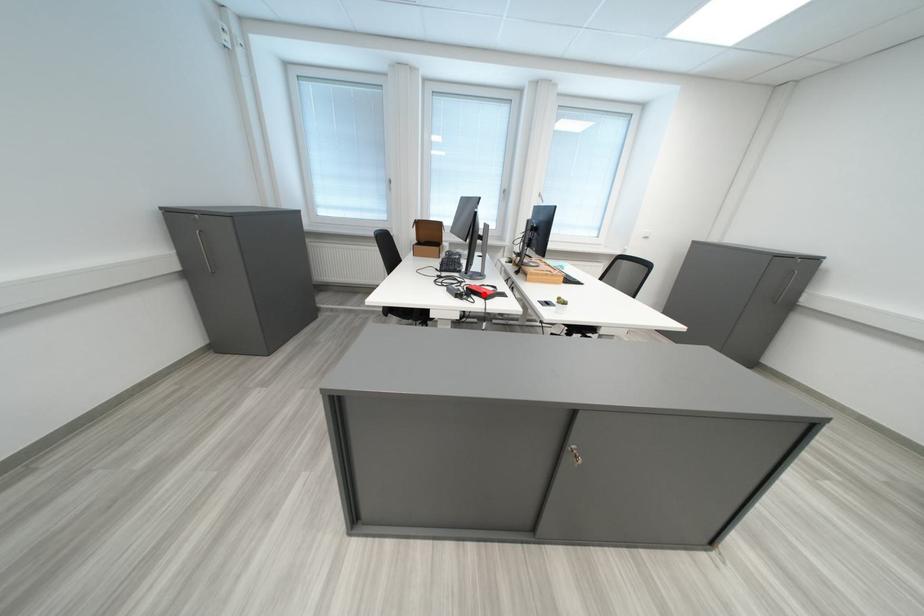
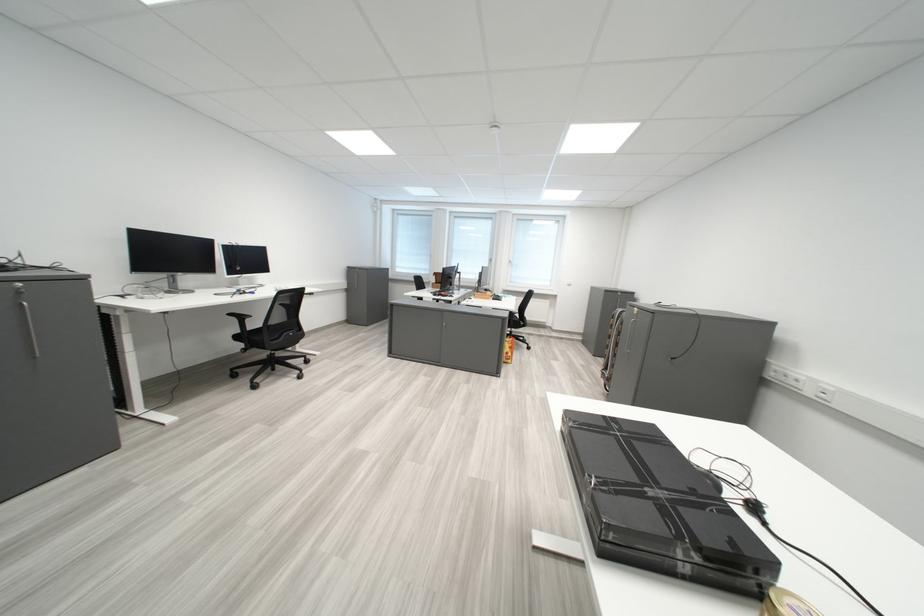
Question: I am providing you with two images of the same scene from different viewpoints. A red point is marked on the first image. At the location where the point appears in image 1, is it still visible in image 2?

Choices:
 (A) Yes
 (B) No

Answer: (B)